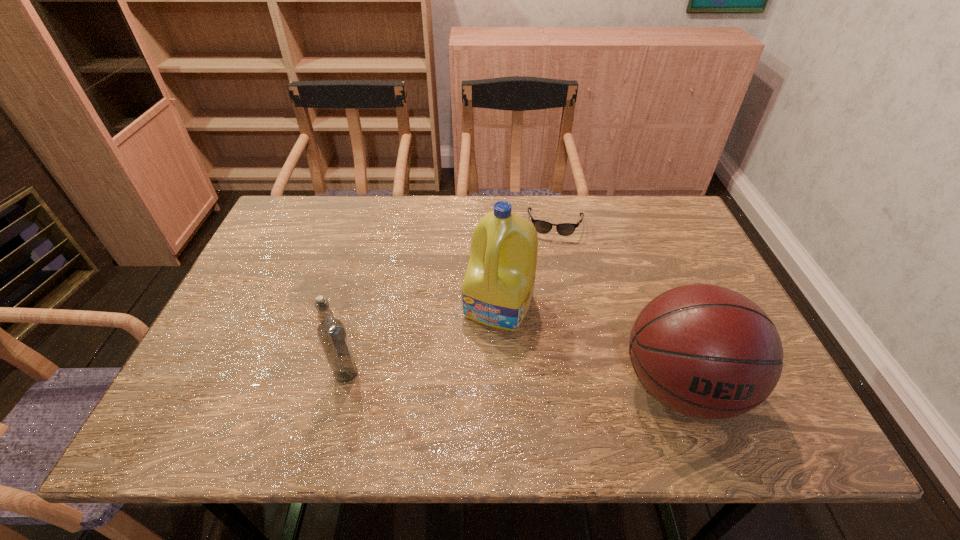
You are a GUI agent. You are given a task and a screenshot of the screen. Output one action in this format:
    pyautogui.click(x=<x>, y=<y>)
    Task: Click on the vacant space situated on the label of the third nearest object
    
    Given the screenshot: What is the action you would take?
    pyautogui.click(x=458, y=389)

The height and width of the screenshot is (540, 960). Identify the location of vacant space located 0.110m on the label of the third nearest object. (468, 367).

I want to click on object present at the far edge, so click(565, 229).

Find the location of a particular element. vodka at the near edge is located at coordinates (331, 332).

Locate an element on the screen. basketball that is positioned at the near edge is located at coordinates (704, 351).

Locate an element on the screen. object that is at the right edge is located at coordinates click(x=704, y=351).

Locate an element on the screen. The width and height of the screenshot is (960, 540). object located in the near right corner section of the desktop is located at coordinates (704, 351).

In the image, there is a desktop. Find the location of `vacant space at the far edge`. vacant space at the far edge is located at coordinates (538, 218).

This screenshot has width=960, height=540. I want to click on vacant space at the near edge of the desktop, so click(x=315, y=377).

The width and height of the screenshot is (960, 540). Identify the location of free spot at the left edge of the desktop. (269, 253).